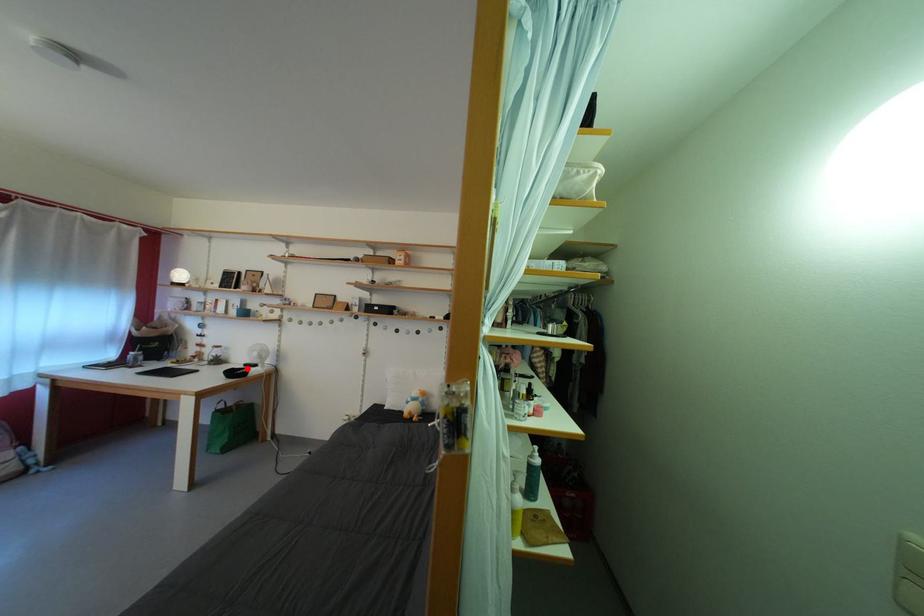
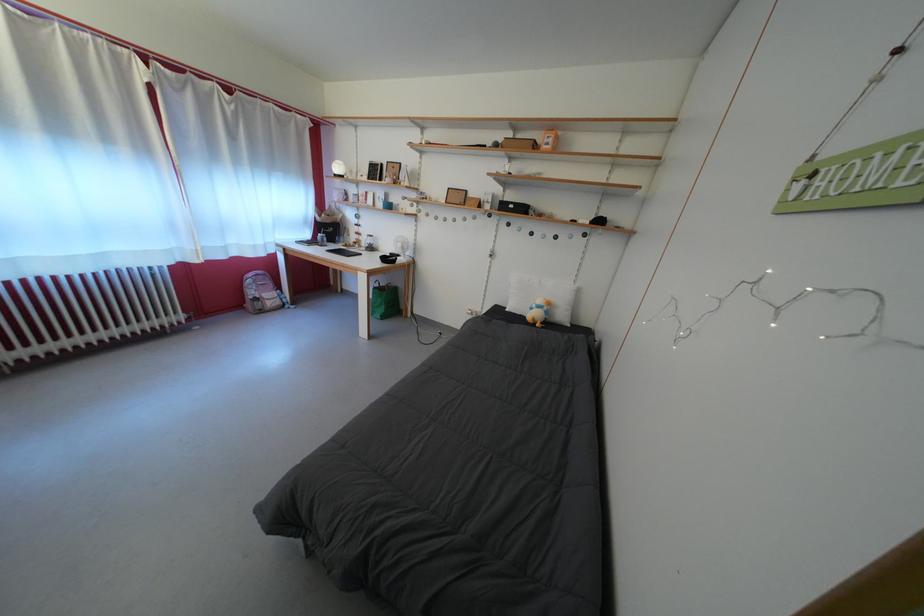
Locate, in the second image, the point that corresponds to the highlighted location in the first image.

(394, 257)